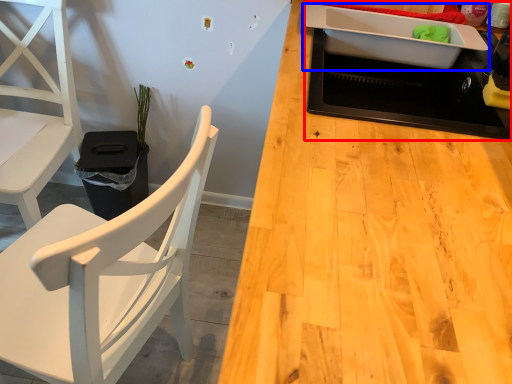
Question: Which object appears closest to the camera in this image, appliance (highlighted by a red box) or kitchen appliance (highlighted by a blue box)?

Choices:
 (A) appliance
 (B) kitchen appliance

Answer: (A)